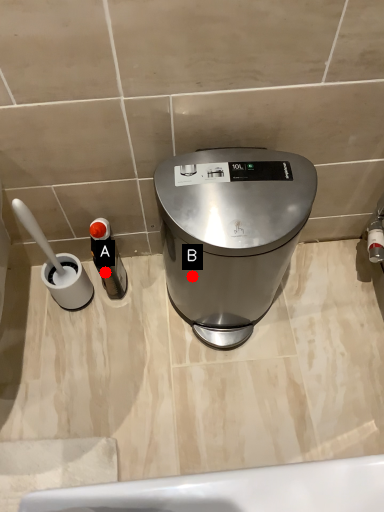
Question: Two points are circled on the image, labeled by A and B beside each circle. Among these points, which one is farthest from the camera?

Choices:
 (A) A is further
 (B) B is further

Answer: (A)